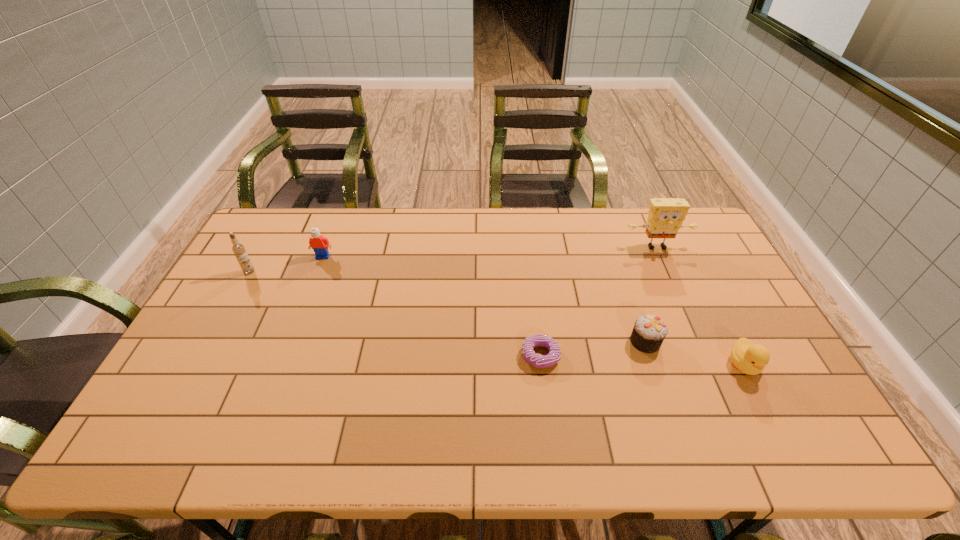
You are a GUI agent. You are given a task and a screenshot of the screen. Output one action in this format:
    pyautogui.click(x=<x>, y=<y>)
    Task: Click on the free area in between the vodka and the sponge
    
    Given the screenshot: What is the action you would take?
    pyautogui.click(x=453, y=259)

This screenshot has width=960, height=540. What are the coordinates of `free space between the duck and the cupcake` in the screenshot? It's located at (694, 353).

Find the location of a particular element. unoccupied area between the cupcake and the Lego is located at coordinates (484, 299).

At what (x,y) coordinates should I click in order to perform the action: click on vacant space that is in between the cupcake and the duck. Please return your answer as a coordinate pair (x, y). The width and height of the screenshot is (960, 540). Looking at the image, I should click on (694, 353).

You are a GUI agent. You are given a task and a screenshot of the screen. Output one action in this format:
    pyautogui.click(x=<x>, y=<y>)
    Task: Click on the unoccupied position between the fifth object from right to left and the cupcake
    The image size is (960, 540).
    Given the screenshot: What is the action you would take?
    pyautogui.click(x=484, y=299)

In order to click on empty space between the cupcake and the Lego in this screenshot , I will do `click(484, 299)`.

Where is `blank region between the cupcake and the fourth shortest object`? The width and height of the screenshot is (960, 540). blank region between the cupcake and the fourth shortest object is located at coordinates (484, 299).

Point out which object is positioned as the fifth nearest to the cupcake. Please provide its 2D coordinates. Your answer should be formatted as a tuple, i.e. [(x, y)], where the tuple contains the x and y coordinates of a point satisfying the conditions above.

[(238, 249)]

The image size is (960, 540). Find the location of `object identified as the closest to the vodka`. object identified as the closest to the vodka is located at coordinates (317, 242).

Where is `free point that satisfies the following two spatial constraints: 1. on the face of the cupcake; 2. on the left side of the third tallest object`? free point that satisfies the following two spatial constraints: 1. on the face of the cupcake; 2. on the left side of the third tallest object is located at coordinates (290, 342).